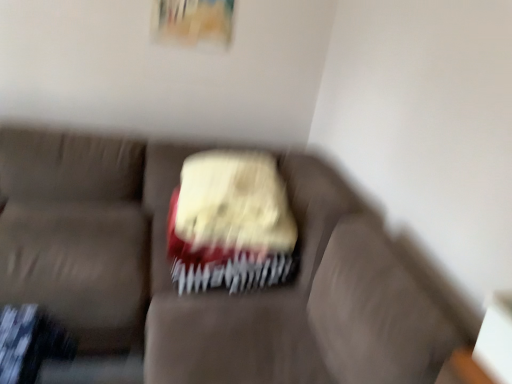
Question: From a real-world perspective, is white textured cake at center positioned above or below matte fabric couch at center?

Choices:
 (A) above
 (B) below

Answer: (A)

Question: Is point (259, 235) closer or farther from the camera than point (72, 206)?

Choices:
 (A) closer
 (B) farther

Answer: (A)

Question: Considering their positions, is white textured cake at center located in front of or behind matte fabric couch at center?

Choices:
 (A) behind
 (B) front

Answer: (A)

Question: Is point (393, 299) positioned closer to the camera than point (248, 225)?

Choices:
 (A) closer
 (B) farther

Answer: (A)

Question: From a real-world perspective, is matte fabric couch at center physically located above or below white textured cake at center?

Choices:
 (A) above
 (B) below

Answer: (B)

Question: Considering their positions, is matte fabric couch at center located in front of or behind white textured cake at center?

Choices:
 (A) behind
 (B) front

Answer: (B)

Question: In terms of width, does matte fabric couch at center look wider or thinner when compared to white textured cake at center?

Choices:
 (A) thin
 (B) wide

Answer: (B)